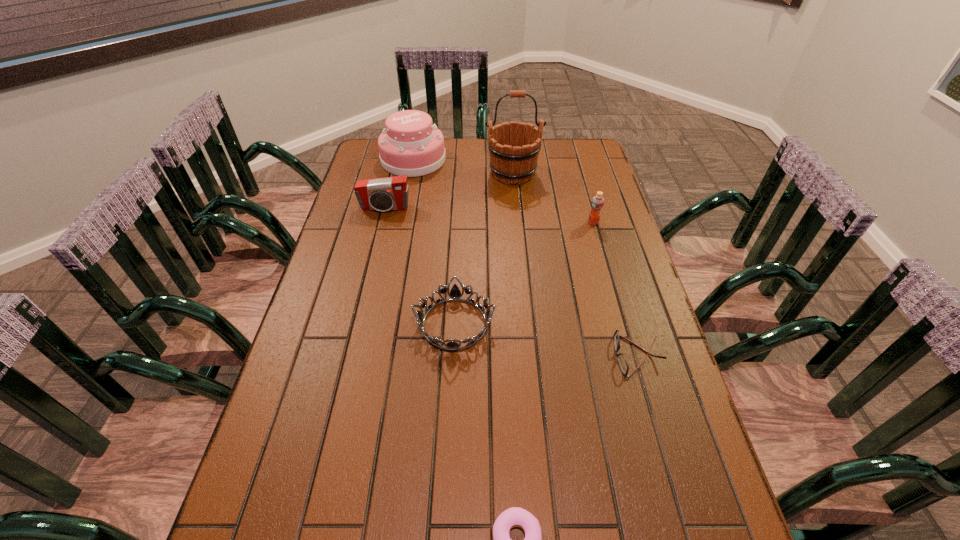
Choose which object is the third nearest neighbor to the doughnut. Please provide its 2D coordinates. Your answer should be formatted as a tuple, i.e. [(x, y)], where the tuple contains the x and y coordinates of a point satisfying the conditions above.

[(597, 203)]

Identify which object is the fifth closest to the sixth tallest object. Please provide its 2D coordinates. Your answer should be formatted as a tuple, i.e. [(x, y)], where the tuple contains the x and y coordinates of a point satisfying the conditions above.

[(389, 193)]